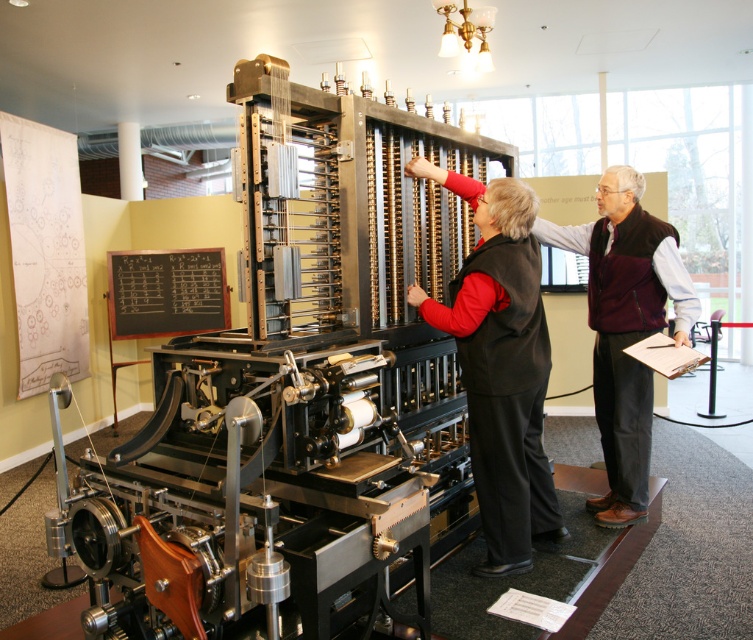
From the picture: Is black vest at center shorter than black chalkboard at center?

Incorrect, black vest at center's height does not fall short of black chalkboard at center's.

Is point (529, 262) positioned behind point (139, 317)?

That is False.

Where is `black vest at center`? The width and height of the screenshot is (753, 640). black vest at center is located at coordinates (601, 307).